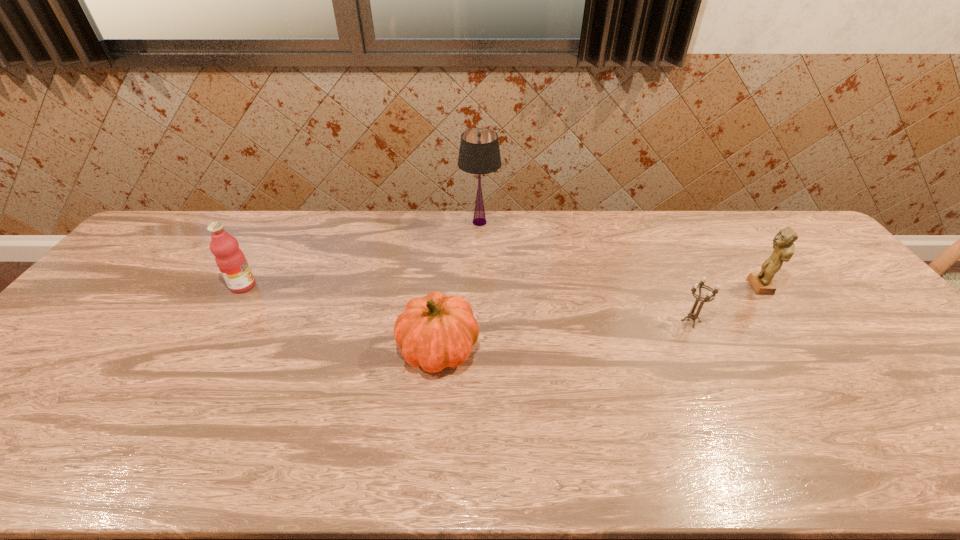
Where is `vacant region located 0.370m on the front-facing side of the rightmost object`? The height and width of the screenshot is (540, 960). vacant region located 0.370m on the front-facing side of the rightmost object is located at coordinates (624, 287).

Identify the location of free space located 0.080m on the front-facing side of the rightmost object. (721, 287).

Locate an element on the screen. vacant area situated 0.400m on the left of the pumpkin is located at coordinates (242, 349).

Find the location of a particular element. This screenshot has height=540, width=960. blank space located on the right of the shortest object is located at coordinates (758, 321).

The height and width of the screenshot is (540, 960). Find the location of `object present at the far edge`. object present at the far edge is located at coordinates (479, 153).

Identify the location of blank space at the far edge of the desktop. (417, 219).

At what (x,y) coordinates should I click in order to perform the action: click on vacant space at the near edge of the desktop. Please return your answer as a coordinate pair (x, y). This screenshot has height=540, width=960. Looking at the image, I should click on (199, 436).

I want to click on free space at the left edge of the desktop, so click(x=104, y=320).

Find the location of a particular element. The height and width of the screenshot is (540, 960). free region at the right edge of the desktop is located at coordinates (903, 356).

In the image, there is a desktop. Where is `free region at the near right corner`? This screenshot has height=540, width=960. free region at the near right corner is located at coordinates (936, 446).